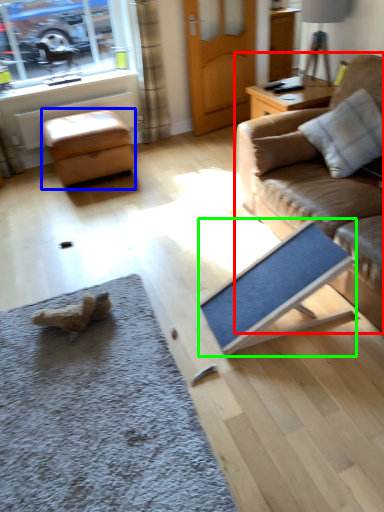
Question: Which is farther away from studio couch (highlighted by a red box)? stool (highlighted by a blue box) or yoga mat (highlighted by a green box)?

Choices:
 (A) stool
 (B) yoga mat

Answer: (A)